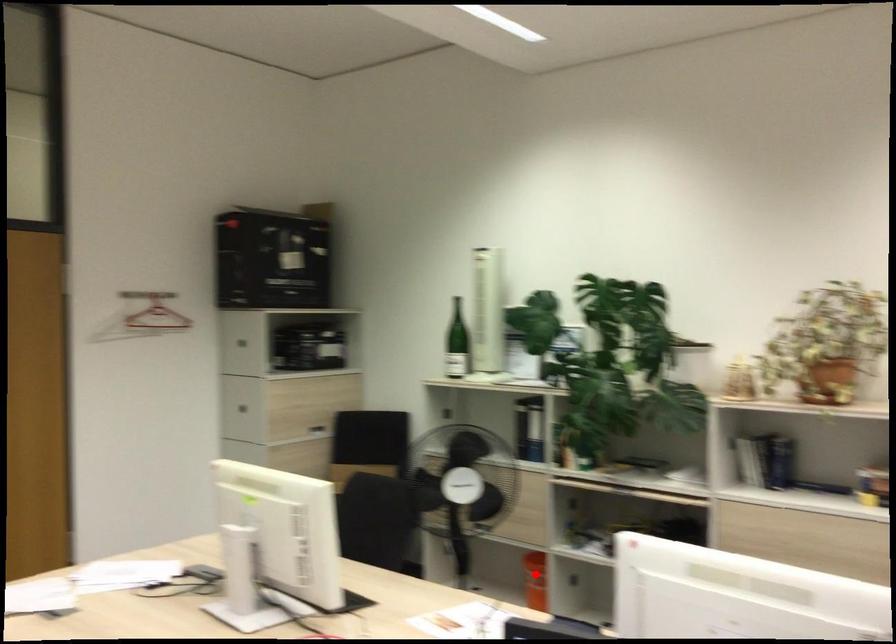
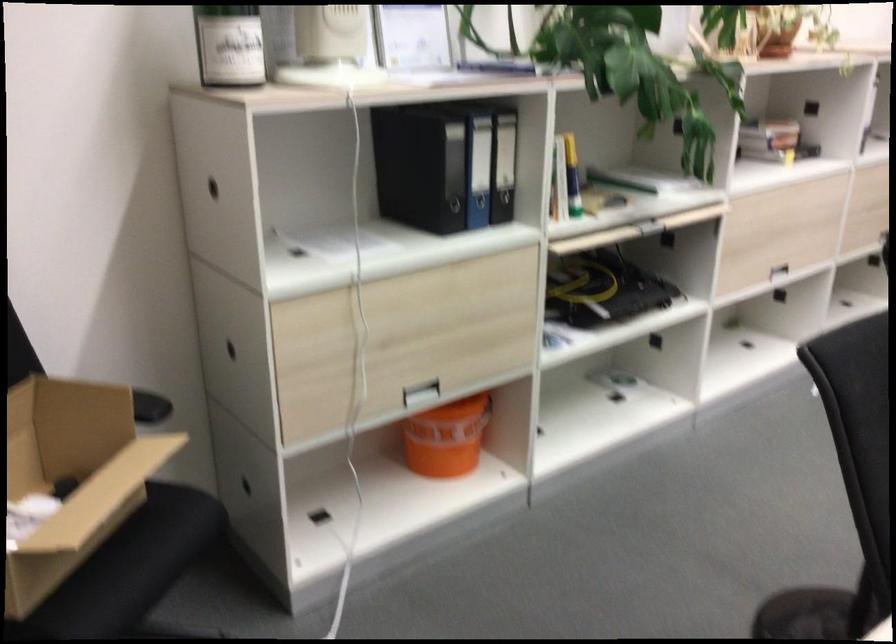
Find the pixel in the second image that matches the highlighted location in the first image.

(446, 438)